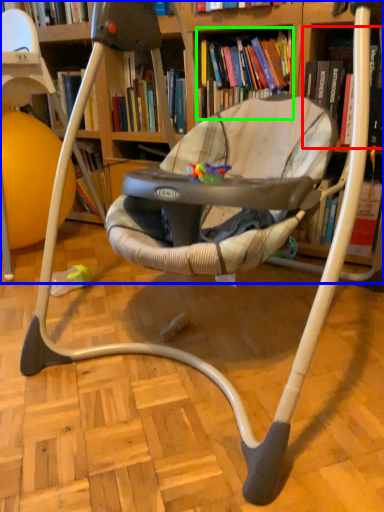
Question: Which object is the farthest from book (highlighted by a red box)? Choose among these: bookcase (highlighted by a blue box) or book (highlighted by a green box).

Choices:
 (A) bookcase
 (B) book

Answer: (A)